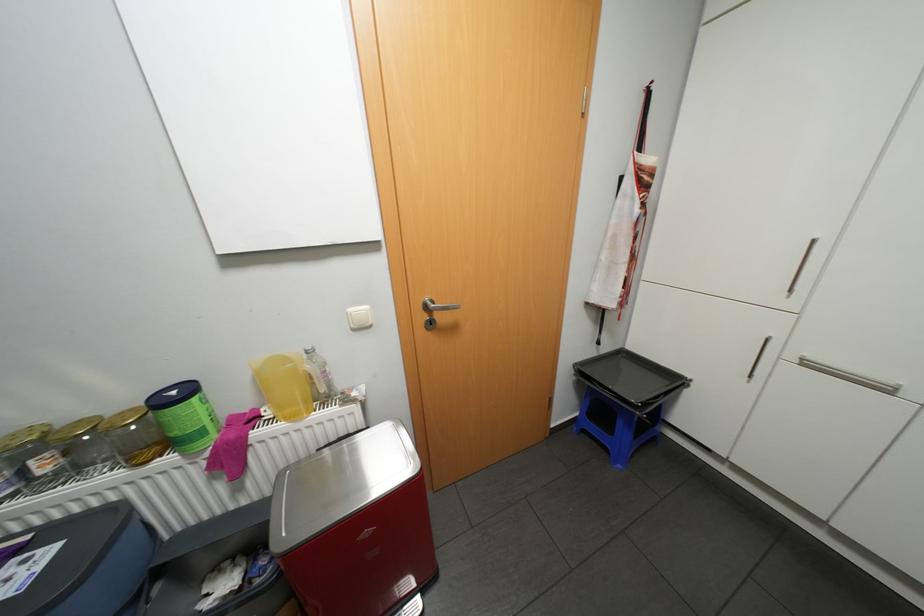
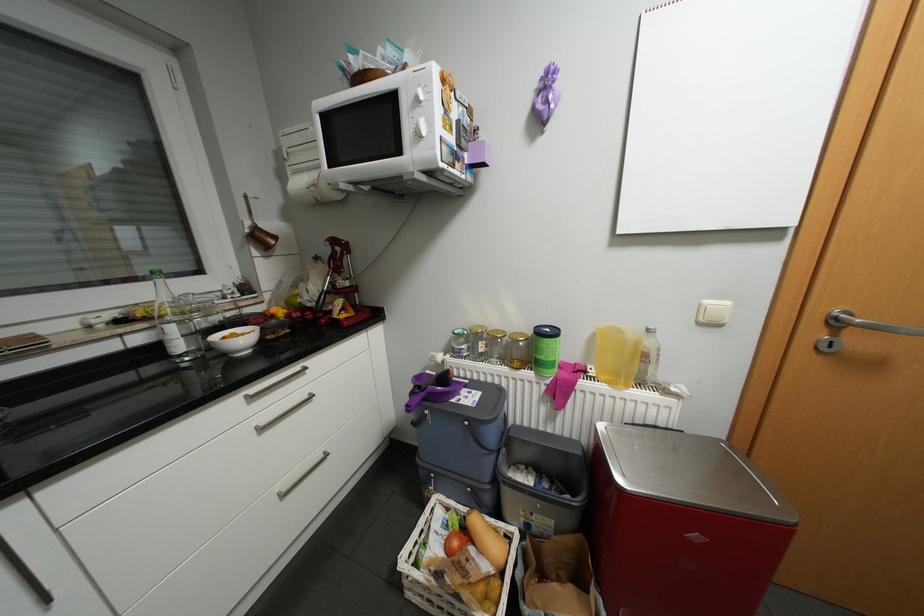
Where in the second image is the point corresponding to (x=246, y=488) from the first image?

(558, 416)